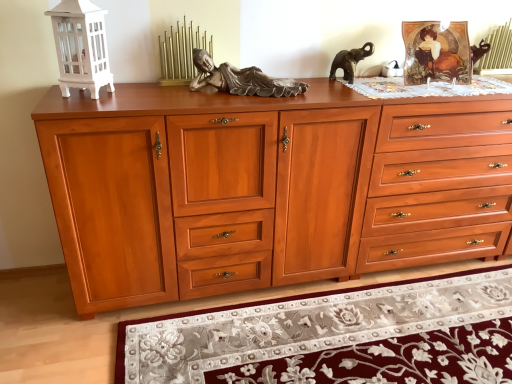
Question: From the image's perspective, would you say cherry wood chest of drawers at center is shown under satin wood drawer at center, arranged as the first drawer when viewed from the left?

Choices:
 (A) yes
 (B) no

Answer: (A)

Question: Does cherry wood chest of drawers at center appear on the left side of satin wood drawer at center, the 2th drawer from the right?

Choices:
 (A) yes
 (B) no

Answer: (B)

Question: From the image's perspective, is cherry wood chest of drawers at center on satin wood drawer at center, arranged as the first drawer when viewed from the left?

Choices:
 (A) no
 (B) yes

Answer: (A)

Question: Does cherry wood chest of drawers at center contain satin wood drawer at center, arranged as the first drawer when viewed from the left?

Choices:
 (A) yes
 (B) no

Answer: (A)

Question: Can you confirm if cherry wood chest of drawers at center is shorter than satin wood drawer at center, the 2th drawer from the right?

Choices:
 (A) no
 (B) yes

Answer: (A)

Question: Is floral rug at lower center situated inside cherry wood chest of drawers at center or outside?

Choices:
 (A) inside
 (B) outside

Answer: (B)

Question: In the image, is floral rug at lower center positioned in front of or behind cherry wood chest of drawers at center?

Choices:
 (A) front
 (B) behind

Answer: (A)

Question: Is floral rug at lower center bigger or smaller than cherry wood chest of drawers at center?

Choices:
 (A) small
 (B) big

Answer: (A)

Question: From a real-world perspective, is floral rug at lower center above or below cherry wood chest of drawers at center?

Choices:
 (A) above
 (B) below

Answer: (B)

Question: In terms of height, does cherry wood chest of drawers at center look taller or shorter compared to floral rug at lower center?

Choices:
 (A) short
 (B) tall

Answer: (B)

Question: From a real-world perspective, relative to floral rug at lower center, is cherry wood chest of drawers at center vertically above or below?

Choices:
 (A) above
 (B) below

Answer: (A)

Question: Considering the positions of point (420, 114) and point (184, 359), is point (420, 114) closer or farther from the camera than point (184, 359)?

Choices:
 (A) closer
 (B) farther

Answer: (B)

Question: Looking at their shapes, would you say cherry wood chest of drawers at center is wider or thinner than floral rug at lower center?

Choices:
 (A) wide
 (B) thin

Answer: (A)

Question: Is floral rug at lower center to the left or to the right of satin wood drawer at center, arranged as the first drawer when viewed from the left, in the image?

Choices:
 (A) right
 (B) left

Answer: (A)

Question: From a real-world perspective, is floral rug at lower center above or below satin wood drawer at center, the 2th drawer from the right?

Choices:
 (A) above
 (B) below

Answer: (B)